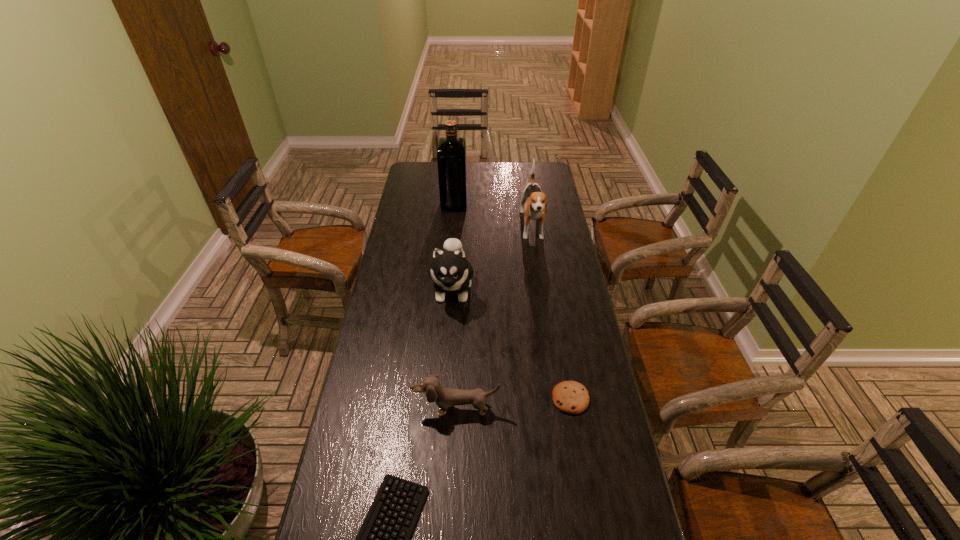
Find the location of a particular element. the tallest object is located at coordinates (451, 155).

Locate an element on the screen. the rightmost puppy is located at coordinates (535, 201).

This screenshot has width=960, height=540. I want to click on the second farthest puppy, so [x=450, y=270].

The image size is (960, 540). What are the coordinates of `the fourth tallest object` in the screenshot? It's located at (444, 397).

Identify the location of the nearest puppy. The image size is (960, 540). (444, 397).

Find the location of a particular element. Image resolution: width=960 pixels, height=540 pixels. the second shortest object is located at coordinates (571, 397).

You are a GUI agent. You are given a task and a screenshot of the screen. Output one action in this format:
    pyautogui.click(x=<x>, y=<y>)
    Task: Click on the vacant space located on the front label of the liquor
    
    Given the screenshot: What is the action you would take?
    pyautogui.click(x=527, y=203)

Find the location of `free space located 0.210m at the face of the rightmost puppy`. free space located 0.210m at the face of the rightmost puppy is located at coordinates (540, 286).

Locate an element on the screen. vacant space located at the face of the fourth nearest object is located at coordinates (444, 416).

This screenshot has height=540, width=960. What are the coordinates of `vacant space positioned at the face of the nearest puppy` in the screenshot? It's located at (455, 435).